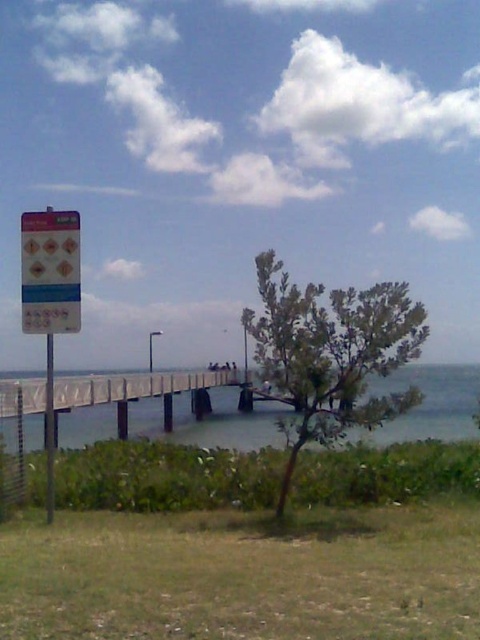
Which is above, purple plastic sign at left or wooden dock at center?

purple plastic sign at left is above.

Between point (46, 419) and point (130, 392), which one is positioned behind?

Point (130, 392)

Is point (43, 308) closer to camera compared to point (1, 406)?

That is True.

The width and height of the screenshot is (480, 640). Identify the location of purple plastic sign at left. (49, 296).

Which is below, purple plastic sign at left or blue plastic sign at left?

purple plastic sign at left

Does point (49, 429) come closer to viewer compared to point (71, 252)?

No, (49, 429) is further to viewer.

Identify the location of purple plastic sign at left. This screenshot has height=640, width=480. (49, 296).

Does wooden dock at center appear over blue plastic sign at left?

No, wooden dock at center is not above blue plastic sign at left.

Between wooden dock at center and blue plastic sign at left, which one is positioned higher?

blue plastic sign at left

This screenshot has height=640, width=480. I want to click on wooden dock at center, so click(x=136, y=392).